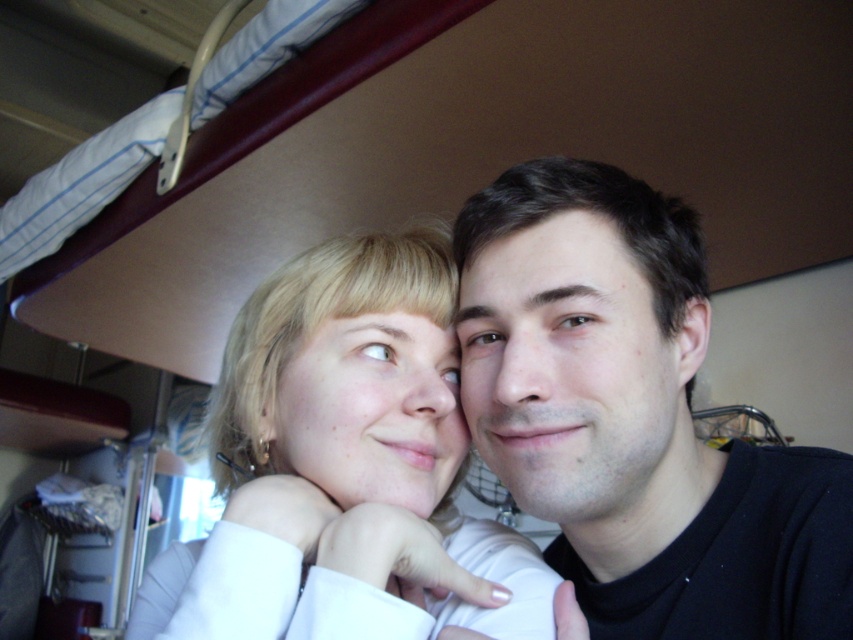
Looking at this image, you are a photographer trying to capture a closeup shot of the smooth skin face at center and the blonde hair at center in the scene. Given that your camera can only focus on one object at a time, which object should you focus on to ensure the facial features are clearly visible?

The smooth skin face at center has a larger size compared to blonde hair at center, so focusing on the smooth skin face at center will ensure the facial features are clearly visible.

In the scene shown: You are a photographer aiming to capture a portrait of the two people in the scene. You want to ensure that both the smooth skin face at center and the blonde hair at center are clearly visible. Based on their positions, which object should you focus on first to ensure both are in frame?

The smooth skin face at center is positioned on the right side of blonde hair at center. To ensure both are in frame, focus on the smooth skin face at center first, as it is closer to the edge, allowing adjustment to include the blonde hair at center.

Based on the scene description, can you determine which object is taller between the smooth skin face at center and the blonde hair at center?

The smooth skin face at center is taller than the blonde hair at center according to the description.